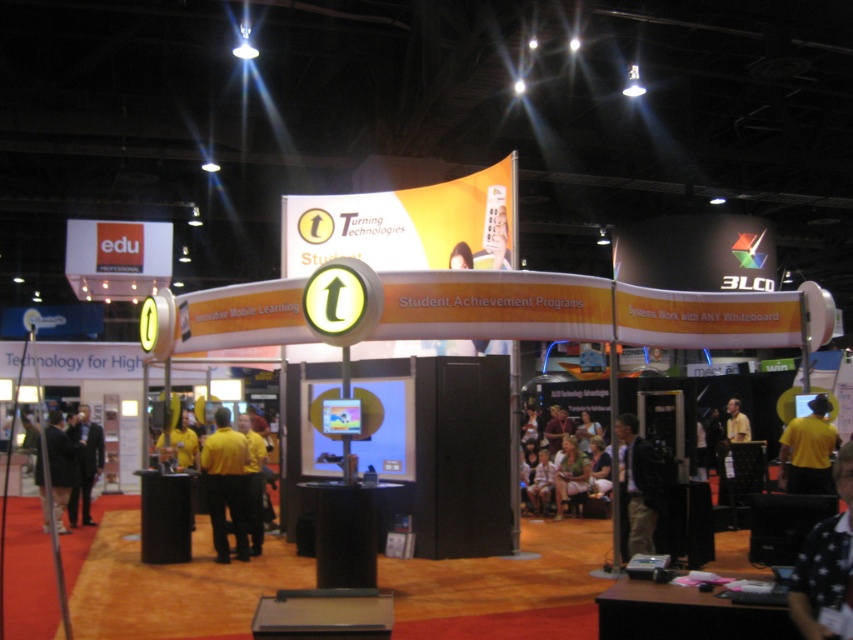
You are at the Turning Technologies booth and need to hand out promotional materials. You have two shirts to distribute, the yellow shirt at lower left and the light green fabric shirt at center. Which shirt should you give to a visitor standing closer to the entrance of the booth?

The yellow shirt at lower left is closer to the viewer than the light green fabric shirt at center, so you should give the yellow shirt at lower left to the visitor near the entrance.